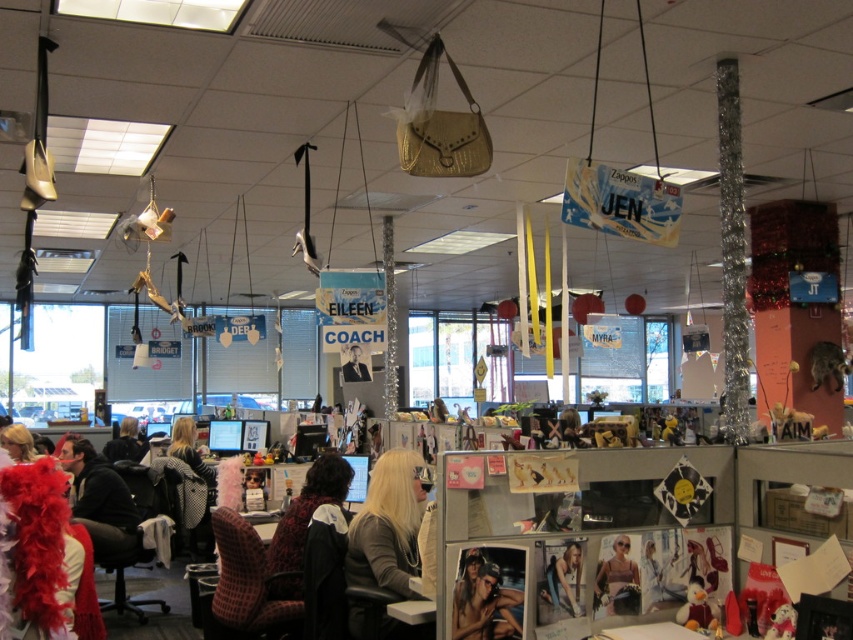
Does matte black jacket at center appear on the left side of matte black suit at center?

Indeed, matte black jacket at center is positioned on the left side of matte black suit at center.

Is matte black jacket at center wider than matte black suit at center?

Yes.

The width and height of the screenshot is (853, 640). What do you see at coordinates (125, 442) in the screenshot? I see `matte black jacket at center` at bounding box center [125, 442].

You are a GUI agent. You are given a task and a screenshot of the screen. Output one action in this format:
    pyautogui.click(x=<x>, y=<y>)
    Task: Click on the matte black jacket at center
    The width and height of the screenshot is (853, 640).
    Given the screenshot: What is the action you would take?
    pyautogui.click(x=125, y=442)

Is matte purple dress at center shorter than plaid shirt at center?

Indeed, matte purple dress at center has a lesser height compared to plaid shirt at center.

Is point (607, 609) positioned in front of point (173, 428)?

Yes, point (607, 609) is closer to viewer.

What do you see at coordinates (618, 580) in the screenshot?
I see `matte purple dress at center` at bounding box center [618, 580].

You are a GUI agent. You are given a task and a screenshot of the screen. Output one action in this format:
    pyautogui.click(x=<x>, y=<y>)
    Task: Click on the matte purple dress at center
    This screenshot has height=640, width=853.
    Given the screenshot: What is the action you would take?
    pyautogui.click(x=618, y=580)

Can you confirm if matte gray sweater at center is positioned above velvet-patterned chair at center?

Yes.

Does point (361, 580) come behind point (213, 486)?

No, (361, 580) is in front of (213, 486).

Who is more forward, (x=358, y=544) or (x=172, y=467)?

Point (x=358, y=544) is in front.

The height and width of the screenshot is (640, 853). Identify the location of matte gray sweater at center. (387, 525).